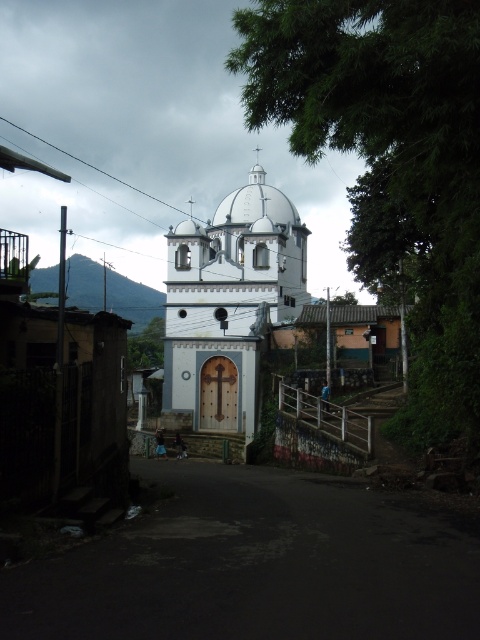
Who is taller, dark asphalt road at center or white smooth church at center?

white smooth church at center is taller.

Is dark asphalt road at center wider than white smooth church at center?

Result: No.

At what (x,y) coordinates should I click in order to perform the action: click on dark asphalt road at center. Please return your answer as a coordinate pair (x, y). The width and height of the screenshot is (480, 640). Looking at the image, I should click on (256, 564).